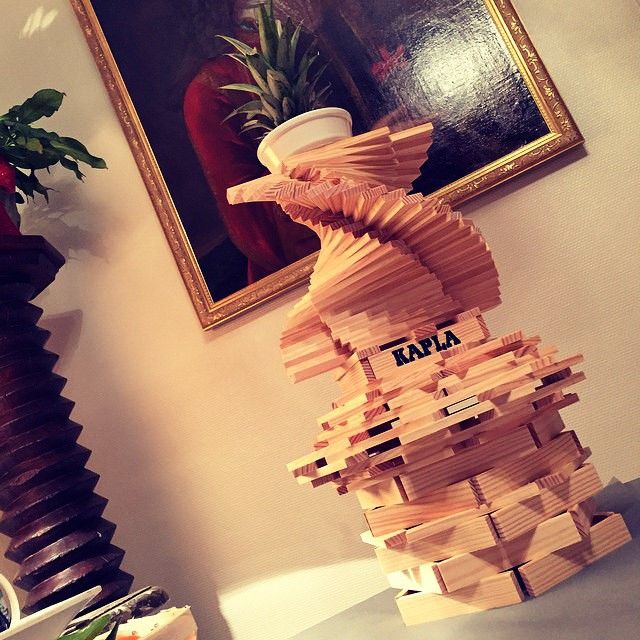
Identify the location of wooden sculpture. The width and height of the screenshot is (640, 640). (416, 307).